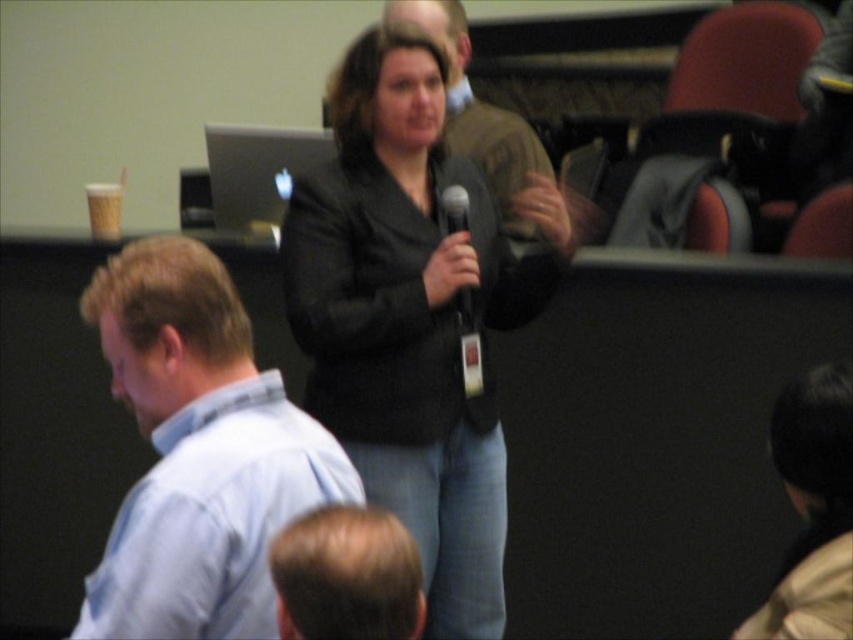
You are an event organizer who needs to arrange seating for attendees. You notice the black matte jacket at center and the blonde hair at lower center in the image. Which object occupies more horizontal space in the scene?

The black matte jacket at center is wider than blonde hair at lower center, so it occupies more horizontal space.

You are an event organizer who needs to arrange seating for attendees. You see the black matte jacket at center and the light blue shirt at left in the image. Which attendee should you seat closer to the front for better visibility, considering their height?

The black matte jacket at center is taller than the light blue shirt at left, so the attendee wearing the light blue shirt at left should be seated closer to the front to ensure they have better visibility.